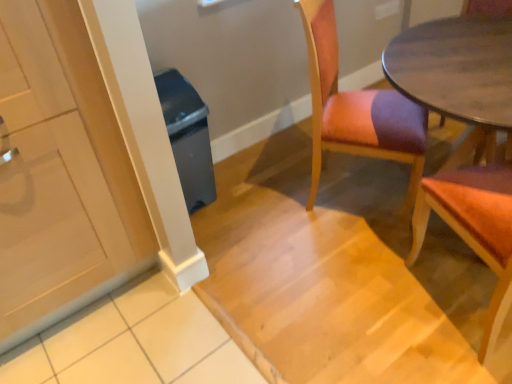
I want to click on free space to the left of wooden upholstered chair at center, acting as the 2th chair starting from the right, so click(x=265, y=209).